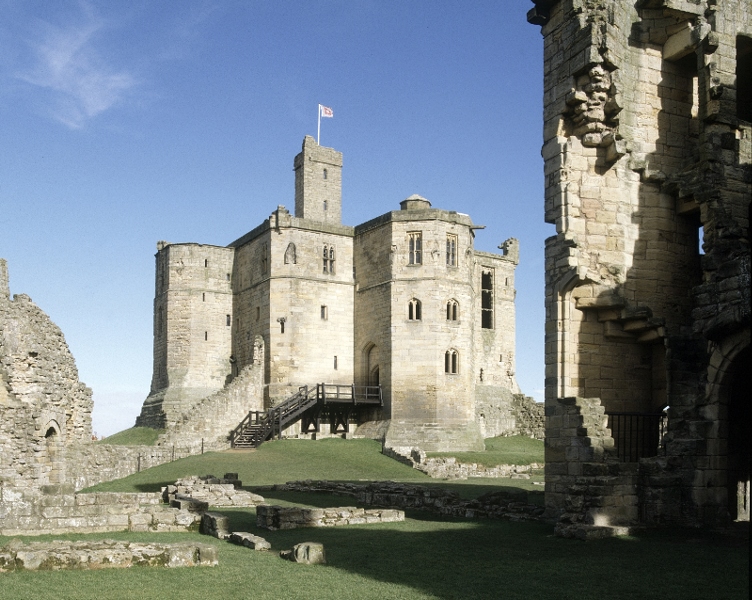
Locate an element on the screen. wooden entry platform is located at coordinates (347, 400).